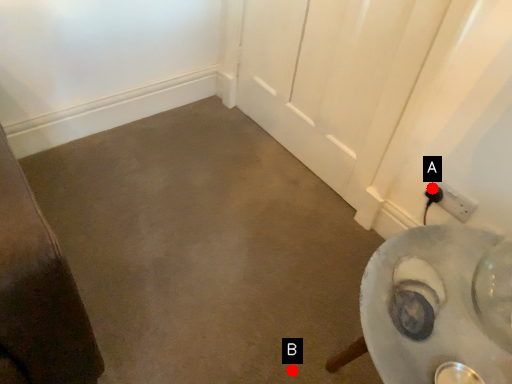
Question: Two points are circled on the image, labeled by A and B beside each circle. Which point is farther to the camera?

Choices:
 (A) A is further
 (B) B is further

Answer: (A)